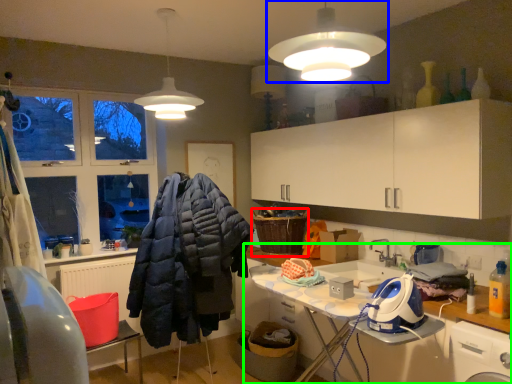
Question: Which object is the closest to the basket (highlighted by a red box)? Choose among these: lamp (highlighted by a blue box) or countertop (highlighted by a green box).

Choices:
 (A) lamp
 (B) countertop

Answer: (B)